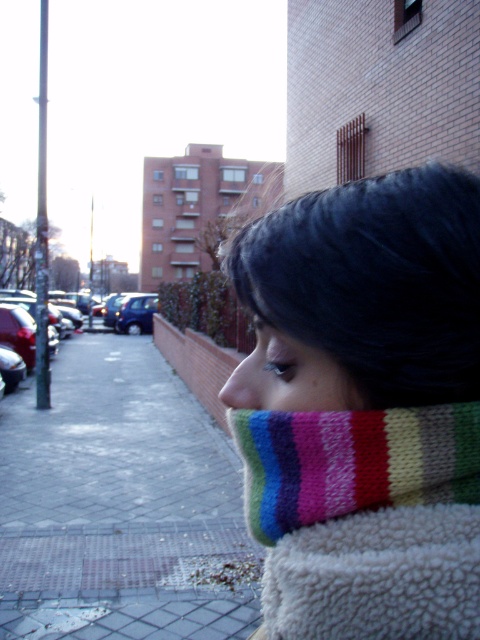
Looking at this image, between knitted scarf at center and multicolored knitted scarf at center, which one appears on the left side from the viewer's perspective?

multicolored knitted scarf at center is more to the left.

This screenshot has width=480, height=640. What are the coordinates of `knitted scarf at center` in the screenshot? It's located at (363, 406).

Is the position of knitted multicolor scarf at lower right more distant than that of multicolored knitted scarf at center?

No, knitted multicolor scarf at lower right is closer to the viewer.

Is knitted multicolor scarf at lower right closer to the viewer compared to multicolored knitted scarf at center?

Yes, knitted multicolor scarf at lower right is in front of multicolored knitted scarf at center.

Is point (476, 499) farther from camera compared to point (278, 332)?

Yes, it is behind point (278, 332).

You are a GUI agent. You are given a task and a screenshot of the screen. Output one action in this format:
    pyautogui.click(x=<x>, y=<y>)
    Task: Click on the knitted multicolor scarf at lower right
    This screenshot has height=640, width=480.
    Given the screenshot: What is the action you would take?
    pyautogui.click(x=352, y=461)

Is knitted multicolor scarf at lower right in front of shiny blue sedan at center?

Yes.

Is knitted multicolor scarf at lower right below shiny blue sedan at center?

Correct, knitted multicolor scarf at lower right is located below shiny blue sedan at center.

What do you see at coordinates (352, 461) in the screenshot? I see `knitted multicolor scarf at lower right` at bounding box center [352, 461].

I want to click on knitted multicolor scarf at lower right, so click(352, 461).